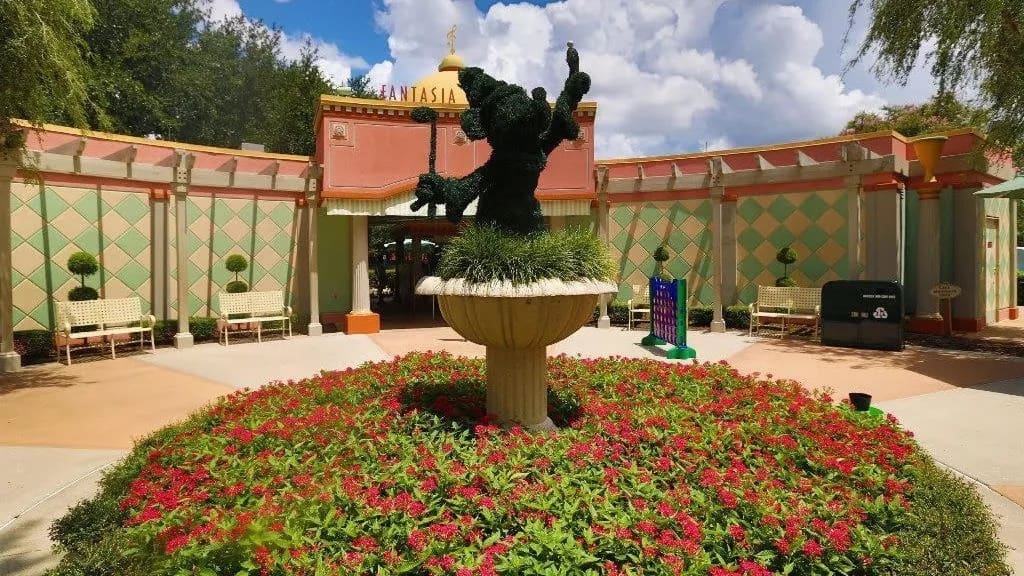
Identify the location of entrance. Image resolution: width=1024 pixels, height=576 pixels. (417, 245).